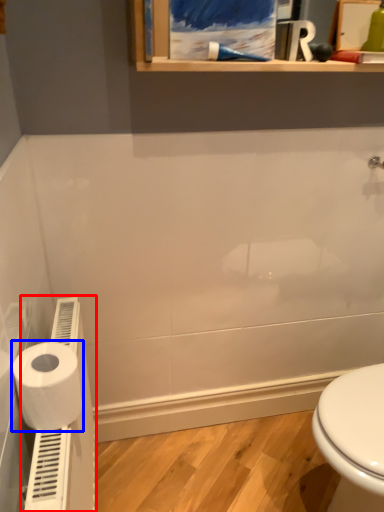
Question: Which object is closer to the camera taking this photo, water heater (highlighted by a red box) or toilet paper (highlighted by a blue box)?

Choices:
 (A) water heater
 (B) toilet paper

Answer: (A)